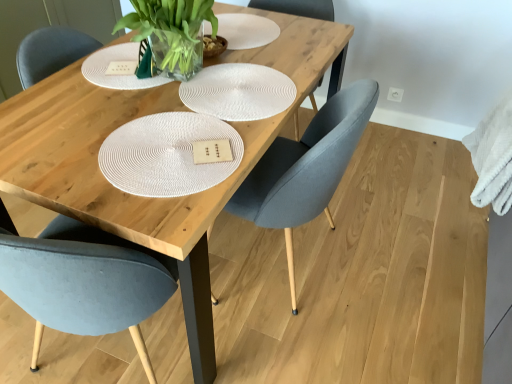
Identify the location of unoccupied region to the right of wooden table at center. (402, 240).